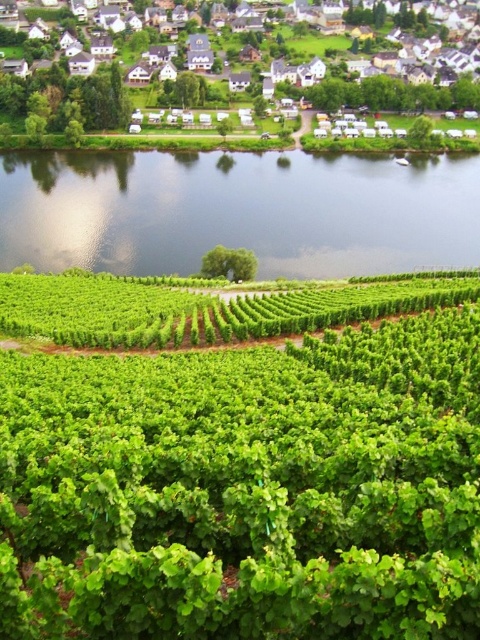
You are standing at the edge of the vineyard and want to walk to the river. Based on the image, which direction should you head towards from the green leafy vines at center to reach the green leafy river at center?

Since the green leafy vines at center is to the right of the green leafy river at center, you should head towards the left to reach the river from the vines.

Consider the image. You are planning to build a bridge over the green leafy river at center. The bridge must be at least as wide as the white wooden houses at upper center to accommodate the traffic. Based on the scene, will the river be wide enough to support such a bridge?

The green leafy river at center is narrower than the white wooden houses at upper center. Since the bridge needs to be as wide as the houses, the river is not wide enough to support the bridge.